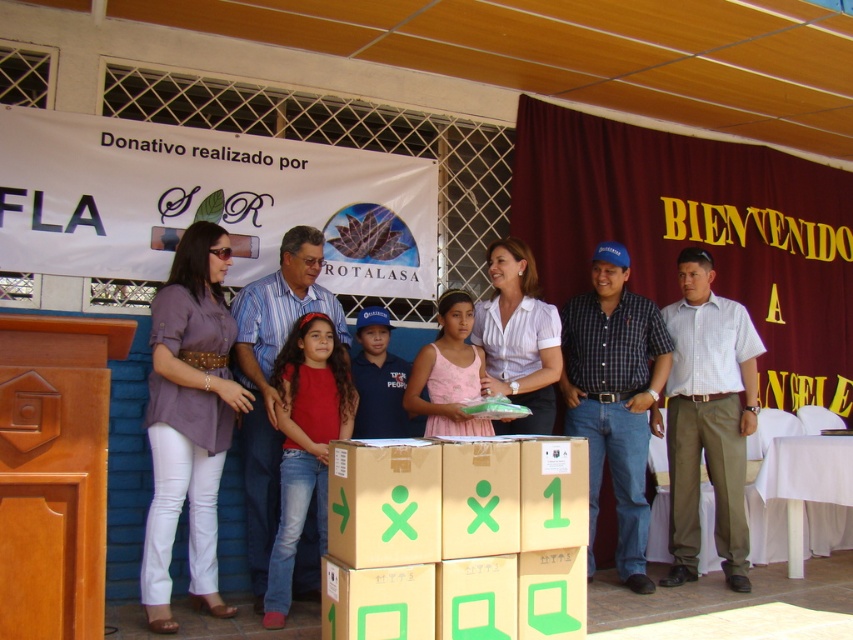
Who is taller, blue plaid shirt at center or blue denim jeans at center?

blue denim jeans at center

Is blue plaid shirt at center above blue denim jeans at center?

No, blue plaid shirt at center is not above blue denim jeans at center.

Between point (604, 417) and point (337, 349), which one is positioned in front?

Point (337, 349) is in front.

Find the location of `blue plaid shirt at center`. blue plaid shirt at center is located at coordinates (614, 397).

Does point (485, 486) come farther from viewer compared to point (578, 381)?

No, (485, 486) is closer to viewer.

Can you confirm if brown cardboard box at center is bigger than blue plaid shirt at center?

Incorrect, brown cardboard box at center is not larger than blue plaid shirt at center.

Describe the element at coordinates (456, 538) in the screenshot. I see `brown cardboard box at center` at that location.

Image resolution: width=853 pixels, height=640 pixels. In order to click on brown cardboard box at center in this screenshot , I will do `click(456, 538)`.

Which of these two, brown cardboard box at center or white checkered shirt at right, stands shorter?

brown cardboard box at center is shorter.

Locate an element on the screen. brown cardboard box at center is located at coordinates (456, 538).